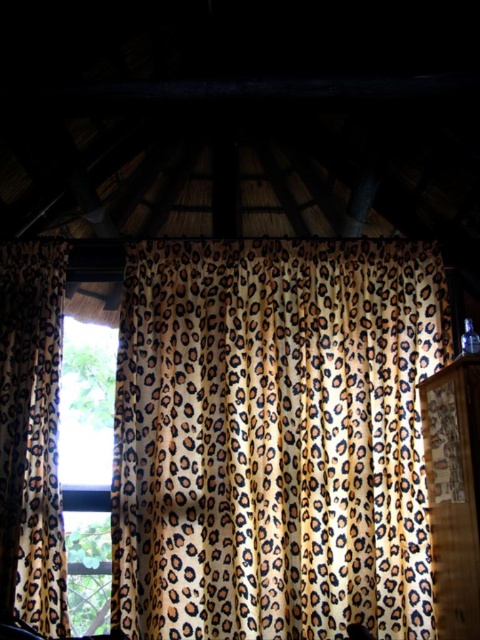
Question: Can you confirm if leopard print fabric at center is smaller than leopard print fabric curtain at left?

Choices:
 (A) yes
 (B) no

Answer: (B)

Question: Which point is closer to the camera?

Choices:
 (A) (x=40, y=378)
 (B) (x=368, y=500)

Answer: (B)

Question: Which object is closer to the camera taking this photo?

Choices:
 (A) leopard print fabric curtain at left
 (B) leopard print fabric at center

Answer: (A)

Question: From the image, what is the correct spatial relationship of leopard print fabric at center in relation to transparent glass window at left?

Choices:
 (A) above
 (B) below

Answer: (A)

Question: Considering the real-world distances, which object is closest to the leopard print fabric curtain at left?

Choices:
 (A) transparent glass window at left
 (B) leopard print fabric at center

Answer: (A)

Question: Can you confirm if leopard print fabric at center is positioned below transparent glass window at left?

Choices:
 (A) yes
 (B) no

Answer: (B)